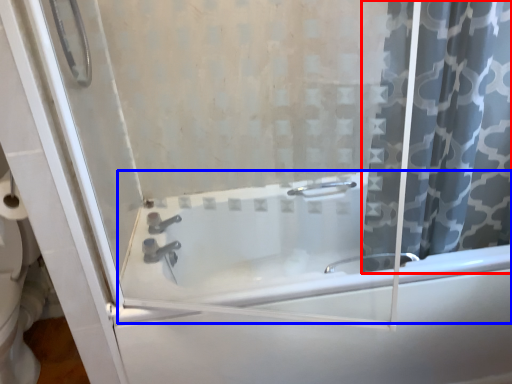
Question: Which of the following is the farthest to the observer, curtain (highlighted by a red box) or bathtub (highlighted by a blue box)?

Choices:
 (A) curtain
 (B) bathtub

Answer: (B)